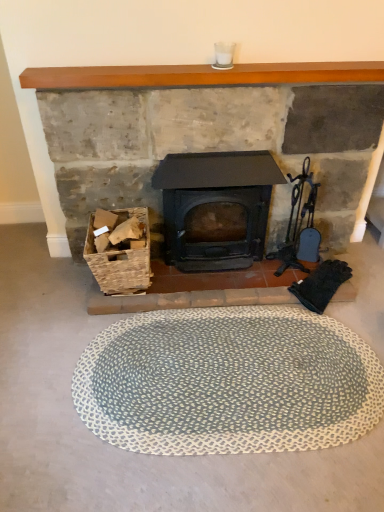
Where is `vacant area that lies between woven wood basket at lower left and matte black wood burning stove at center`? This screenshot has width=384, height=512. vacant area that lies between woven wood basket at lower left and matte black wood burning stove at center is located at coordinates (200, 285).